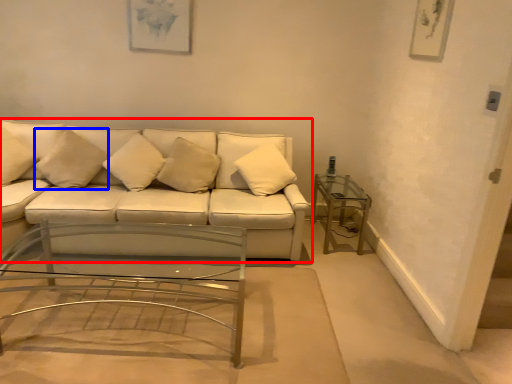
Question: Which of the following is the closest to the observer, studio couch (highlighted by a red box) or pillow (highlighted by a blue box)?

Choices:
 (A) studio couch
 (B) pillow

Answer: (A)